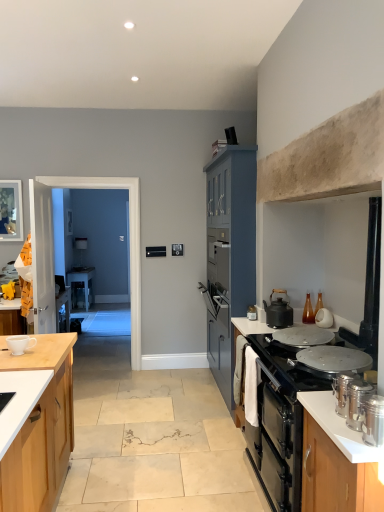
Question: From the image's perspective, is black plastic phone at upper center under white glossy countertop at right, the 1th countertop from the bottom?

Choices:
 (A) no
 (B) yes

Answer: (A)

Question: Is black plastic phone at upper center smaller than white glossy countertop at right, the 1th countertop from the bottom?

Choices:
 (A) yes
 (B) no

Answer: (A)

Question: Is black plastic phone at upper center at the right side of white glossy countertop at right, which is counted as the first countertop, starting from the back?

Choices:
 (A) no
 (B) yes

Answer: (A)

Question: Considering the relative positions of black plastic phone at upper center and white glossy countertop at right, which is counted as the first countertop, starting from the back, in the image provided, is black plastic phone at upper center to the left of white glossy countertop at right, which is counted as the first countertop, starting from the back, from the viewer's perspective?

Choices:
 (A) no
 (B) yes

Answer: (B)

Question: Does black plastic phone at upper center turn towards white glossy countertop at right, which is counted as the first countertop, starting from the back?

Choices:
 (A) no
 (B) yes

Answer: (A)

Question: Is point (289, 308) closer or farther from the camera than point (246, 315)?

Choices:
 (A) farther
 (B) closer

Answer: (B)

Question: From the image's perspective, is matte black kettle at right, the third kitchen appliance positioned from the front, located above or below matte black kettle at right, the fourth kitchen appliance from the front?

Choices:
 (A) below
 (B) above

Answer: (B)

Question: Considering the positions of matte black kettle at right, the third kitchen appliance positioned from the front, and matte black kettle at right, the fourth kitchen appliance from the front, in the image, is matte black kettle at right, the third kitchen appliance positioned from the front, bigger or smaller than matte black kettle at right, the fourth kitchen appliance from the front,?

Choices:
 (A) big
 (B) small

Answer: (A)

Question: Is matte black kettle at right, the third kitchen appliance positioned from the front, to the left or to the right of matte black kettle at right, the fourth kitchen appliance from the front, in the image?

Choices:
 (A) left
 (B) right

Answer: (B)

Question: Considering the positions of point (345, 384) and point (74, 293), is point (345, 384) closer or farther from the camera than point (74, 293)?

Choices:
 (A) farther
 (B) closer

Answer: (B)

Question: Visually, is satin silver canisters at right, placed as the 3th kitchen appliance when sorted from back to front, positioned to the left or to the right of matte black desk at center?

Choices:
 (A) right
 (B) left

Answer: (A)

Question: Considering the positions of satin silver canisters at right, the 2th kitchen appliance when ordered from front to back, and matte black desk at center in the image, is satin silver canisters at right, the 2th kitchen appliance when ordered from front to back, taller or shorter than matte black desk at center?

Choices:
 (A) tall
 (B) short

Answer: (B)

Question: Is satin silver canisters at right, the 2th kitchen appliance when ordered from front to back, inside the boundaries of matte black desk at center, or outside?

Choices:
 (A) inside
 (B) outside

Answer: (B)

Question: From the image's perspective, relative to transparent glass door at left, the 2th glass door in the back-to-front sequence, is matte black desk at center above or below?

Choices:
 (A) below
 (B) above

Answer: (A)

Question: Looking at their shapes, would you say matte black desk at center is wider or thinner than transparent glass door at left, placed as the first glass door when sorted from front to back?

Choices:
 (A) wide
 (B) thin

Answer: (A)